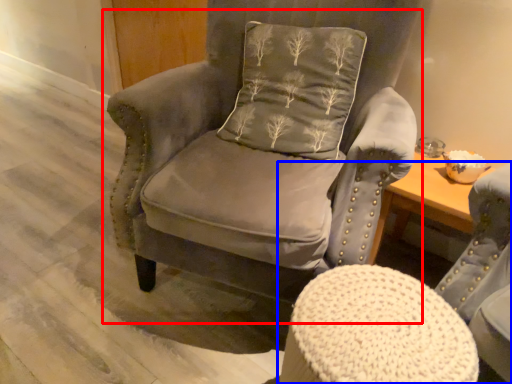
Question: Which object appears closest to the camera in this image, chair (highlighted by a red box) or chair (highlighted by a blue box)?

Choices:
 (A) chair
 (B) chair

Answer: (B)